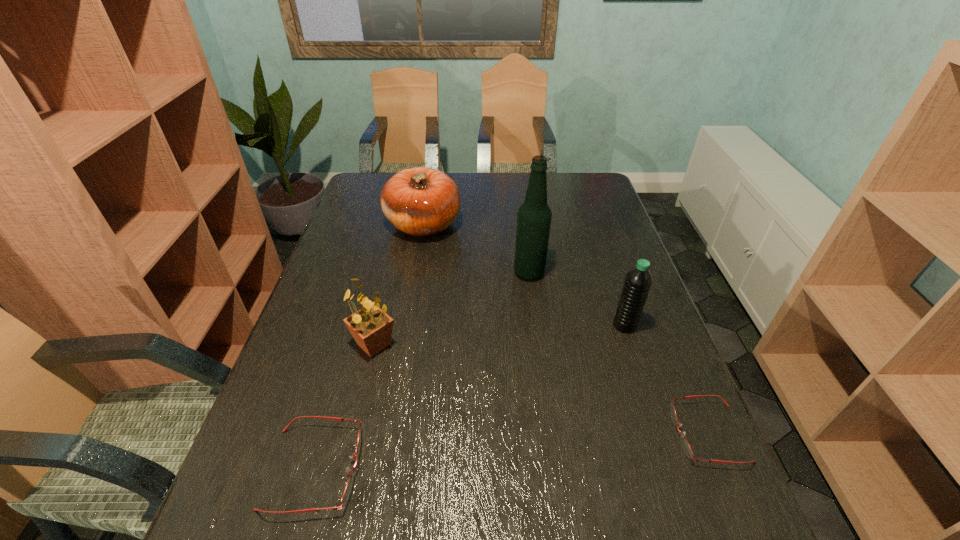
Image resolution: width=960 pixels, height=540 pixels. In order to click on sunflower present at the left edge in this screenshot , I will do `click(371, 327)`.

You are a GUI agent. You are given a task and a screenshot of the screen. Output one action in this format:
    pyautogui.click(x=<x>, y=<y>)
    Task: Click on the spectacles present at the right edge
    
    Given the screenshot: What is the action you would take?
    pyautogui.click(x=686, y=447)

What are the coordinates of `water bottle present at the right edge` in the screenshot? It's located at (638, 280).

The image size is (960, 540). In order to click on object present at the far left corner in this screenshot , I will do `click(420, 201)`.

Where is `object at the near left corner`? The height and width of the screenshot is (540, 960). object at the near left corner is located at coordinates (347, 490).

Image resolution: width=960 pixels, height=540 pixels. I want to click on object that is at the near right corner, so click(x=686, y=447).

Locate an element on the screen. This screenshot has height=540, width=960. vacant space at the far edge of the desktop is located at coordinates (519, 177).

The image size is (960, 540). What are the coordinates of `free point at the left edge` in the screenshot? It's located at (363, 254).

Identify the location of vacant space at the right edge of the desktop. click(x=602, y=229).

You are a GUI agent. You are given a task and a screenshot of the screen. Output one action in this format:
    pyautogui.click(x=<x>, y=<y>)
    Task: Click on the vacant region at the far right corner of the desktop
    This screenshot has height=540, width=960.
    Given the screenshot: What is the action you would take?
    pyautogui.click(x=600, y=201)